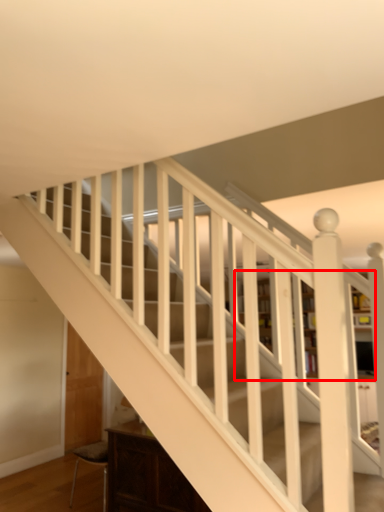
Question: From the image's perspective, what is the correct spatial relationship of bookcase (annotated by the red box) in relation to furniture?

Choices:
 (A) below
 (B) above

Answer: (B)